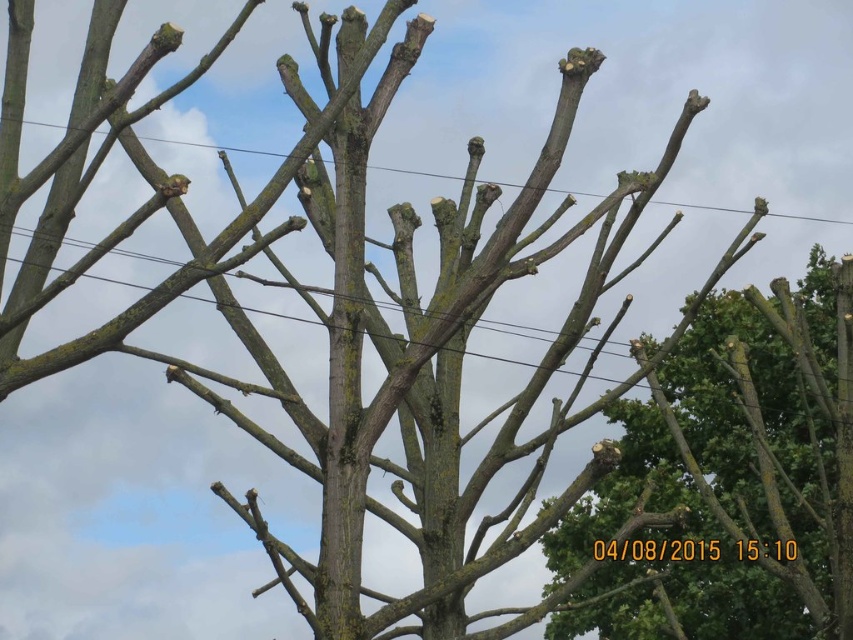
Question: Does brown rough bark at right appear on the right side of brown wood power line at upper center?

Choices:
 (A) yes
 (B) no

Answer: (A)

Question: Can you confirm if brown rough bark at right is positioned to the left of brown rough wood at center?

Choices:
 (A) yes
 (B) no

Answer: (B)

Question: Which object is the closest to the brown rough wood at center?

Choices:
 (A) brown rough bark at right
 (B) brown wood power line at upper center

Answer: (A)

Question: Among these objects, which one is farthest from the camera?

Choices:
 (A) brown rough wood at center
 (B) brown wood power line at upper center

Answer: (B)

Question: Considering the real-world distances, which object is farthest from the brown rough bark at right?

Choices:
 (A) brown wood power line at upper center
 (B) brown rough wood at center

Answer: (A)

Question: Is brown rough bark at right to the left of brown rough wood at center from the viewer's perspective?

Choices:
 (A) no
 (B) yes

Answer: (A)